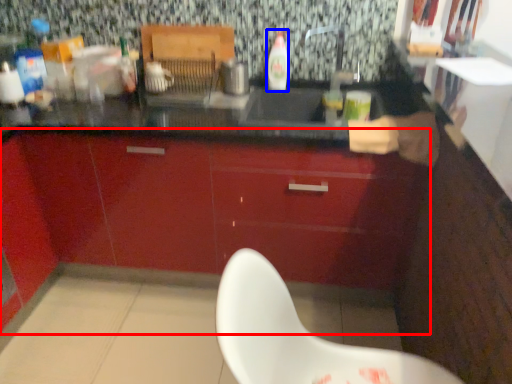
Question: Which object is closer to the camera taking this photo, cabinetry (highlighted by a red box) or bottle (highlighted by a blue box)?

Choices:
 (A) cabinetry
 (B) bottle

Answer: (A)